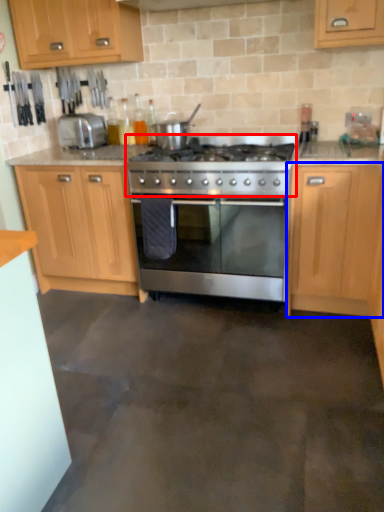
Question: Which of the following is the closest to the observer, gas stove (highlighted by a red box) or cabinetry (highlighted by a blue box)?

Choices:
 (A) gas stove
 (B) cabinetry

Answer: (B)